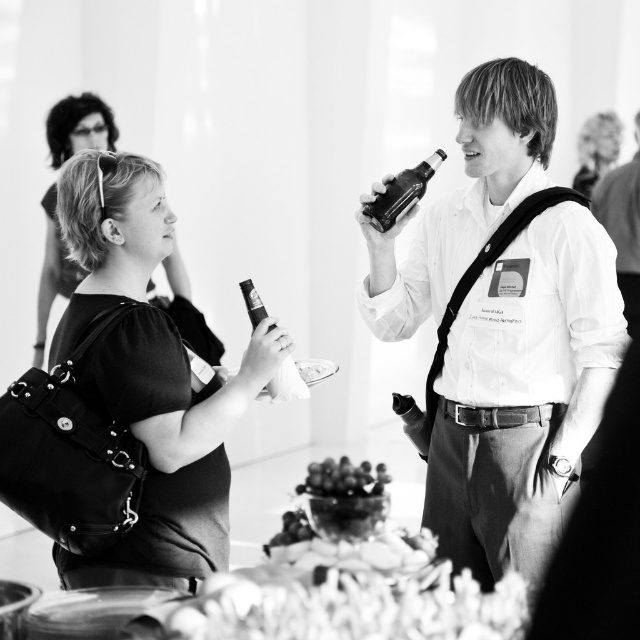
Does point (513, 344) lie behind point (616, 144)?

No.

Can you confirm if smooth glass bottle at center is positioned to the left of smooth skin face at upper right?

Indeed, smooth glass bottle at center is positioned on the left side of smooth skin face at upper right.

Is point (547, 481) more distant than point (580, 134)?

That is False.

Identify the location of smooth glass bottle at center. (502, 332).

Find the location of a particular element. smooth glass bottle at center is located at coordinates (502, 332).

Does smooth glass bottle at center appear over shiny glass bottle at upper right?

Incorrect, smooth glass bottle at center is not positioned above shiny glass bottle at upper right.

You are a GUI agent. You are given a task and a screenshot of the screen. Output one action in this format:
    pyautogui.click(x=<x>, y=<y>)
    Task: Click on the smooth glass bottle at center
    Image resolution: width=640 pixels, height=640 pixels.
    Given the screenshot: What is the action you would take?
    pyautogui.click(x=502, y=332)

Who is lower down, smooth glass grapes at center or matte glass bottle at center?

smooth glass grapes at center is below.

Find the location of a particular element. smooth glass grapes at center is located at coordinates (342, 477).